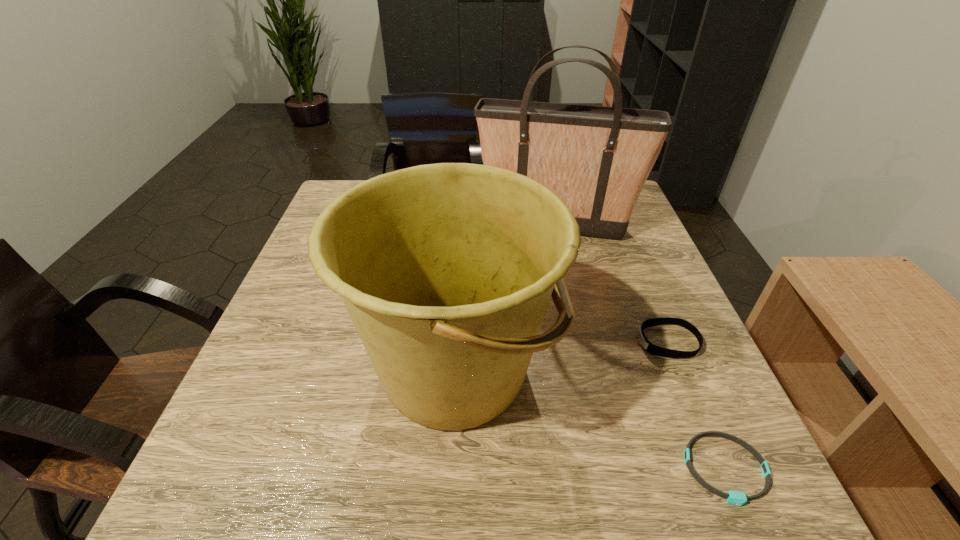
What are the coordinates of `the farthest object` in the screenshot? It's located at (597, 159).

Identify the location of shopping bag. (597, 159).

What are the coordinates of `bucket` in the screenshot? It's located at (446, 270).

You are a GUI agent. You are given a task and a screenshot of the screen. Output one action in this format:
    pyautogui.click(x=<x>, y=<y>)
    Task: Click on the farther wristband
    The height and width of the screenshot is (540, 960).
    Given the screenshot: What is the action you would take?
    pyautogui.click(x=652, y=349)

I want to click on the third tallest object, so click(x=652, y=349).

Locate an element on the screen. Image resolution: width=960 pixels, height=540 pixels. the nearer wristband is located at coordinates (733, 497).

At what (x,y) coordinates should I click in order to perform the action: click on the shorter wristband. Please return your answer as a coordinate pair (x, y). Looking at the image, I should click on (733, 497).

Identify the location of free point located on the front of the shopping bag. Image resolution: width=960 pixels, height=540 pixels. (574, 309).

Locate an element on the screen. The height and width of the screenshot is (540, 960). vacant position located 0.270m on the side of the second tallest object with the handle is located at coordinates (701, 369).

The height and width of the screenshot is (540, 960). In order to click on free location located 0.060m on the display of the third tallest object in this screenshot , I will do `click(607, 342)`.